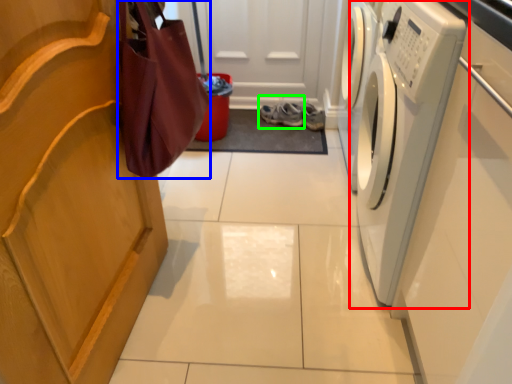
Question: Which is nearer to the washing machine (highlighted by a red box)? shopping bag (highlighted by a blue box) or footwear (highlighted by a green box).

Choices:
 (A) shopping bag
 (B) footwear

Answer: (A)